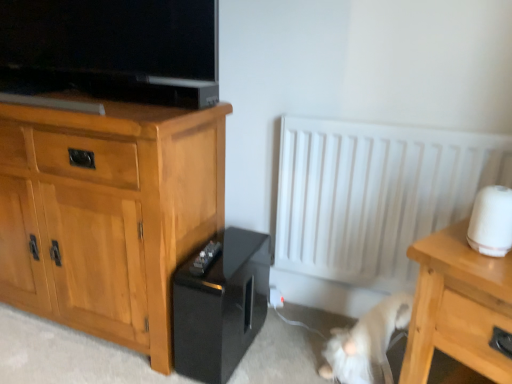
I want to click on vacant space situated above white matte radiator at center (from a real-world perspective), so click(386, 120).